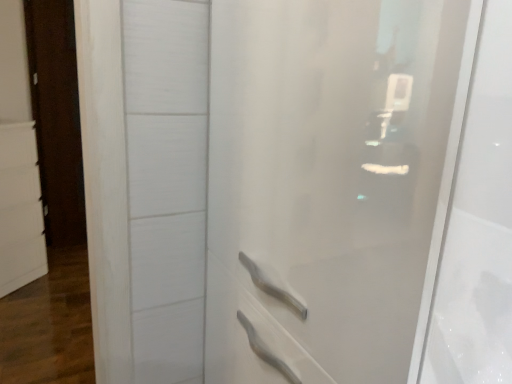
What do you see at coordinates (19, 207) in the screenshot? I see `white matte cabinet at left` at bounding box center [19, 207].

Locate an element on the screen. white matte cabinet at left is located at coordinates (19, 207).

Where is `white matte cabinet at left`? Image resolution: width=512 pixels, height=384 pixels. white matte cabinet at left is located at coordinates (19, 207).